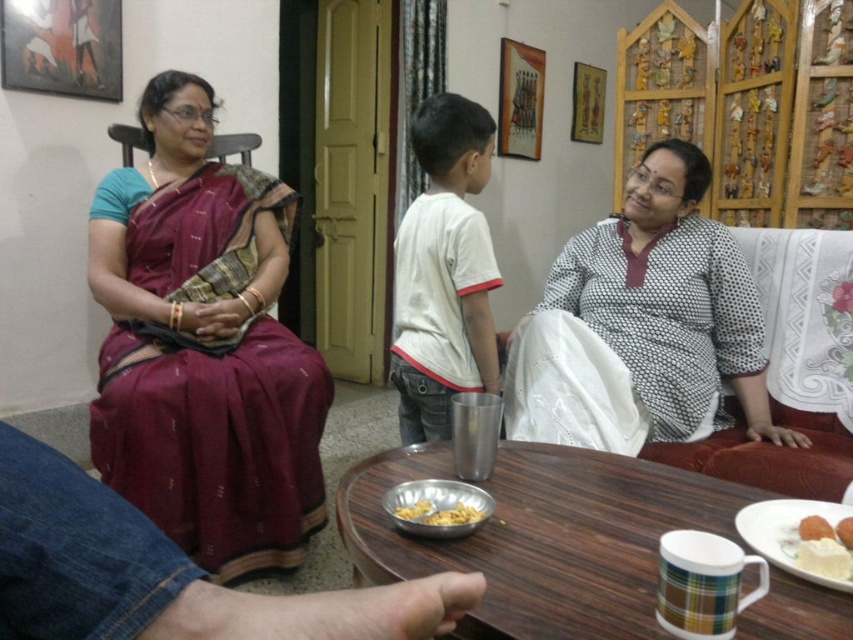
Question: Which of the following is the closest to the observer?

Choices:
 (A) shiny metallic bowl at center
 (B) maroon silk saree at left
 (C) brown crumbly bread at lower right

Answer: (A)

Question: Which point is farther to the camera?

Choices:
 (A) wooden table at center
 (B) white dotted fabric at right
 (C) maroon silk saree at left
 (D) brown crumbly bread at lower right

Answer: (C)

Question: In this image, where is shiny metallic bowl at center located relative to golden textured rice at center?

Choices:
 (A) right
 (B) left

Answer: (A)

Question: Does maroon silk saree at left have a smaller size compared to golden textured rice at center?

Choices:
 (A) yes
 (B) no

Answer: (B)

Question: Which point is closer to the camera?

Choices:
 (A) (302, 394)
 (B) (393, 515)
 (C) (477, 512)
 (D) (689, 284)

Answer: (B)

Question: Can you confirm if white dotted fabric at right is positioned above brown crumbly bread at lower right?

Choices:
 (A) no
 (B) yes

Answer: (B)